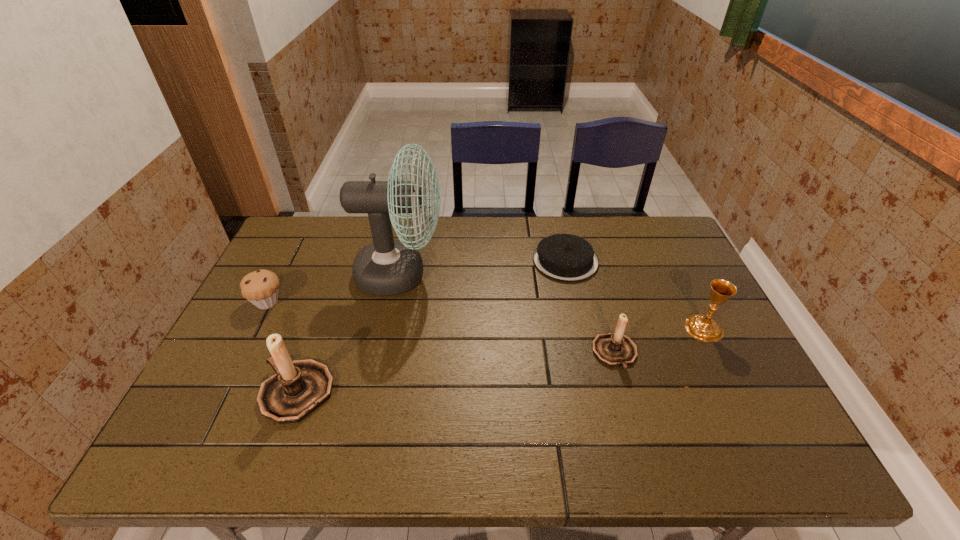
Image resolution: width=960 pixels, height=540 pixels. Find the location of `object positioned at the near left corner`. object positioned at the near left corner is located at coordinates (299, 387).

Image resolution: width=960 pixels, height=540 pixels. What are the coordinates of `vacant space at the far edge of the desktop` in the screenshot? It's located at (331, 246).

In the image, there is a desktop. At what (x,y) coordinates should I click in order to perform the action: click on free space at the near edge. Please return your answer as a coordinate pair (x, y). This screenshot has height=540, width=960. Looking at the image, I should click on (391, 392).

This screenshot has height=540, width=960. In order to click on vacant space at the left edge of the desktop in this screenshot , I will do `click(299, 289)`.

Find the location of a particular element. This screenshot has height=540, width=960. vacant space at the right edge of the desktop is located at coordinates (694, 366).

You are a GUI agent. You are given a task and a screenshot of the screen. Output one action in this format:
    pyautogui.click(x=<x>, y=<y>)
    Task: Click on the vacant space at the far left corner of the desktop
    
    Given the screenshot: What is the action you would take?
    pyautogui.click(x=301, y=254)

In the image, there is a desktop. Identify the location of vacant space at the far right corner. The width and height of the screenshot is (960, 540). (661, 249).

This screenshot has height=540, width=960. In order to click on vacant space at the near right corner in this screenshot , I will do `click(732, 421)`.

At what (x,y) coordinates should I click in order to perform the action: click on free space between the fan and the chalice. Please return your answer as a coordinate pair (x, y). The width and height of the screenshot is (960, 540). Looking at the image, I should click on (552, 301).

Find the location of `free spot between the pancake and the second tallest object`. free spot between the pancake and the second tallest object is located at coordinates (431, 327).